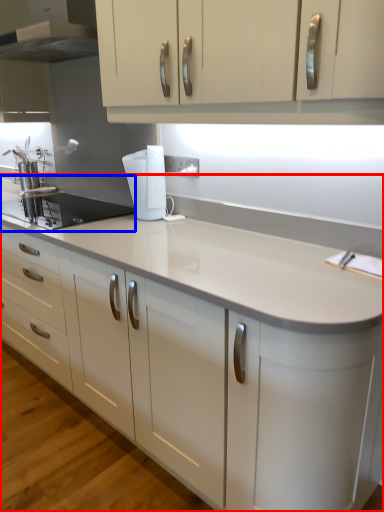
Question: Which object is further to the camera taking this photo, countertop (highlighted by a red box) or sink (highlighted by a blue box)?

Choices:
 (A) countertop
 (B) sink

Answer: (B)